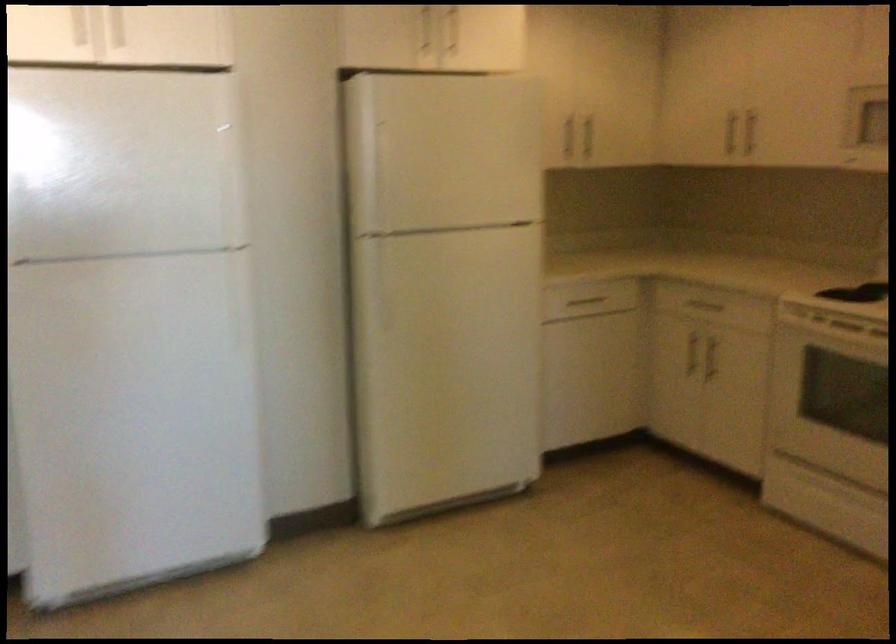
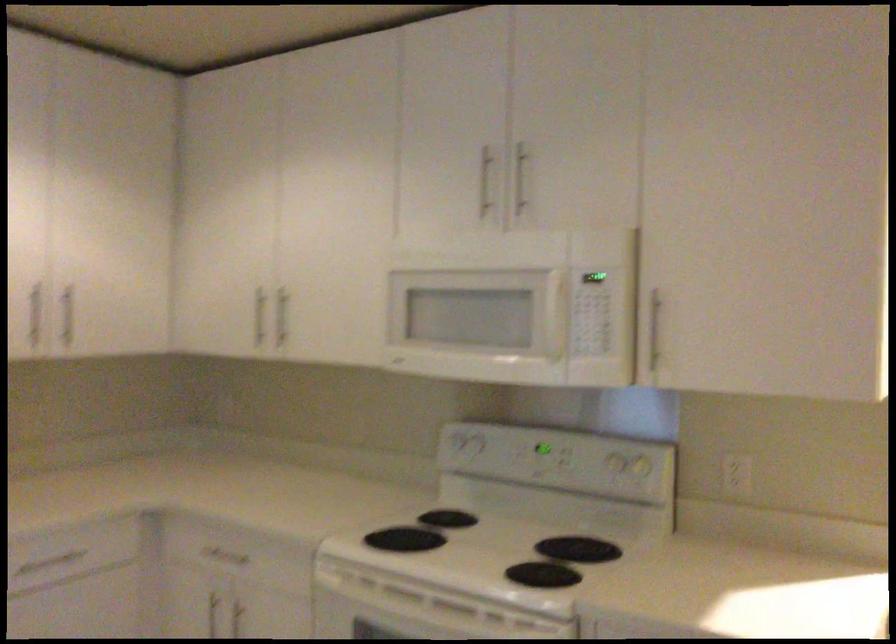
Locate, in the second image, the point that corresponds to pixel 728 129 in the first image.

(259, 316)